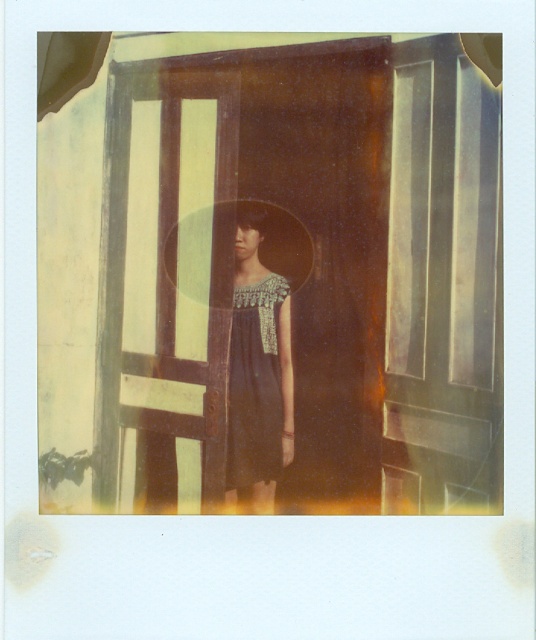
Question: Is the position of black satin dress at center more distant than that of dark blue textured dress at center?

Choices:
 (A) yes
 (B) no

Answer: (B)

Question: Is the position of black satin dress at center less distant than that of dark blue textured dress at center?

Choices:
 (A) no
 (B) yes

Answer: (B)

Question: Can you confirm if black satin dress at center is positioned to the right of dark blue textured dress at center?

Choices:
 (A) yes
 (B) no

Answer: (A)

Question: Which point is closer to the camera?

Choices:
 (A) (256, 483)
 (B) (254, 404)

Answer: (A)